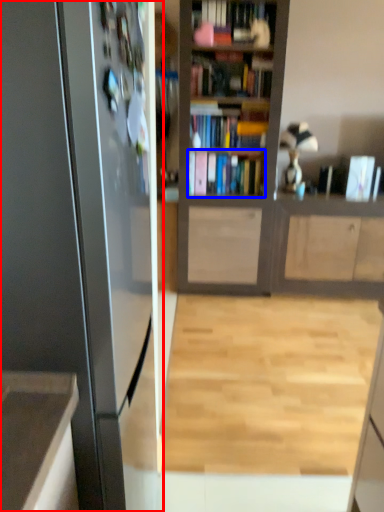
Question: Among these objects, which one is nearest to the camera, appliance (highlighted by a red box) or book (highlighted by a blue box)?

Choices:
 (A) appliance
 (B) book

Answer: (A)